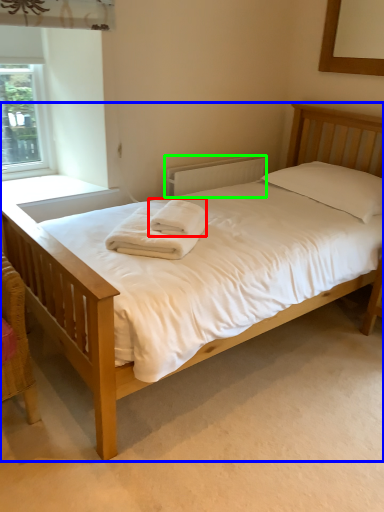
Question: Estimate the real-world distances between objects in this image. Which object is farther from bath towel (highlighted by a red box), bed (highlighted by a blue box) or radiator (highlighted by a green box)?

Choices:
 (A) bed
 (B) radiator

Answer: (B)